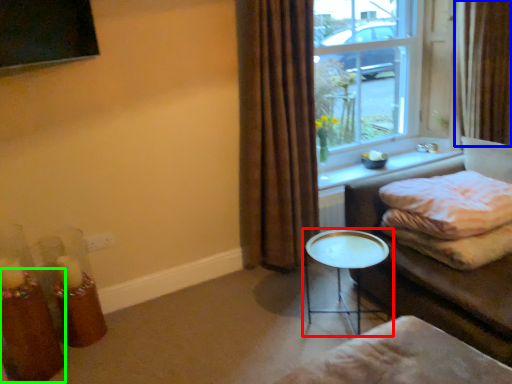
Question: Estimate the real-world distances between objects in this image. Which object is farther from table (highlighted by a red box), curtain (highlighted by a blue box) or candle holder (highlighted by a green box)?

Choices:
 (A) curtain
 (B) candle holder

Answer: (A)